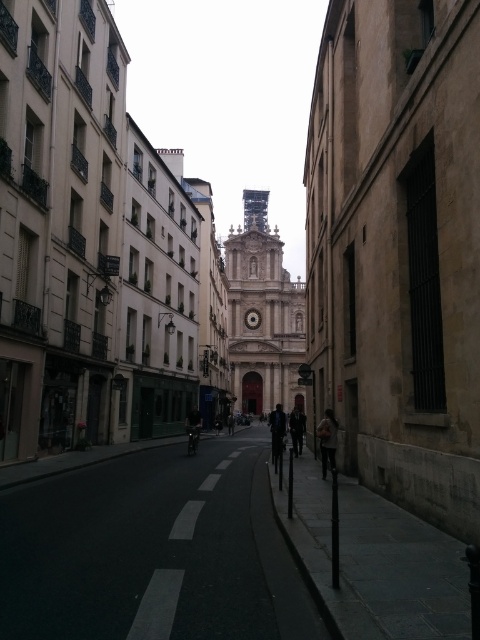
Question: Which point is closer to the camera?

Choices:
 (A) dark asphalt road at center
 (B) dark brown leather jacket at center
 (C) dark blue jeans at center

Answer: (A)

Question: Does dark gray fabric jacket at center lie in front of dark blue jeans at center?

Choices:
 (A) yes
 (B) no

Answer: (A)

Question: Which point is farther from the camera taking this photo?

Choices:
 (A) (300, 416)
 (B) (250, 196)
 (C) (43, 630)

Answer: (B)

Question: Does dark asphalt road at center appear on the right side of gray fabric bag at center?

Choices:
 (A) no
 (B) yes

Answer: (A)

Question: Considering the relative positions of dark brown leather jacket at center and dark blue jeans at center in the image provided, where is dark brown leather jacket at center located with respect to dark blue jeans at center?

Choices:
 (A) above
 (B) below

Answer: (B)

Question: Which point is farther to the camera?

Choices:
 (A) dark asphalt road at center
 (B) dark blue jeans at center
 (C) dark brown leather jacket at center
 (D) gray fabric bag at center

Answer: (B)